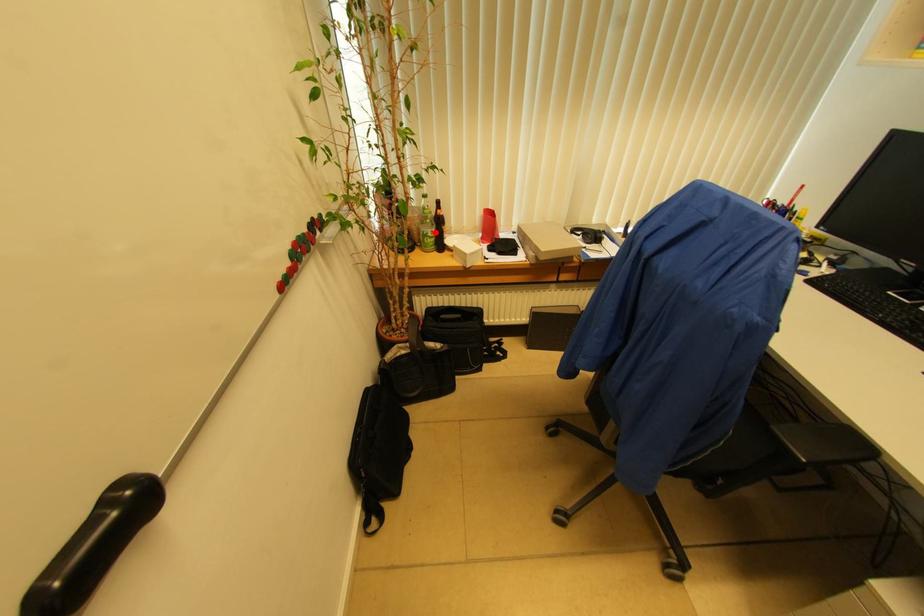
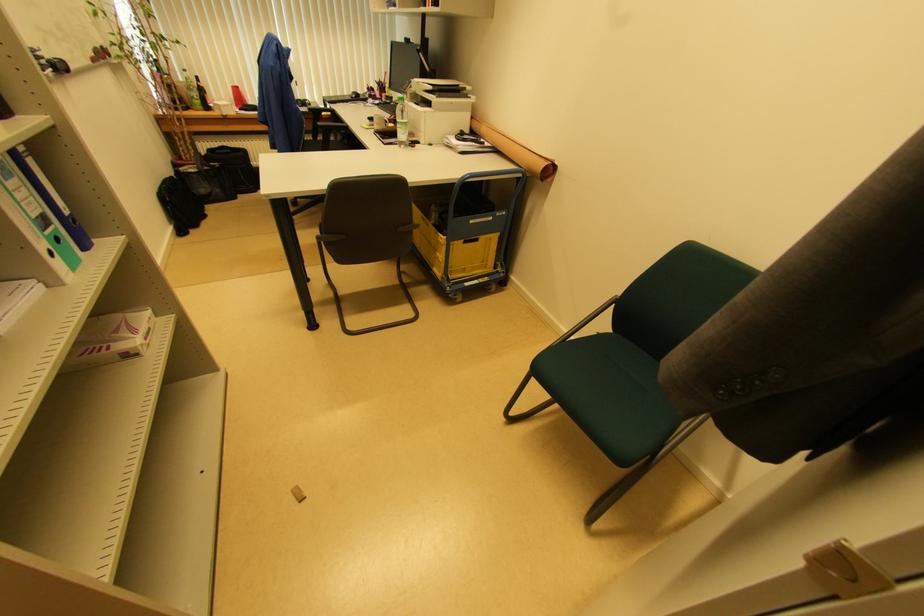
Question: I am providing you with two images of the same scene from different viewpoints. In image1, a red point is highlighted. Considering the same 3D point in image2, which of the following is correct?

Choices:
 (A) It is closer
 (B) It is farther

Answer: (B)